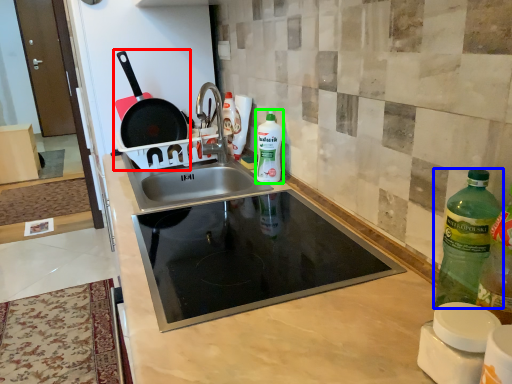
Question: Which object is the farthest from frying pan (highlighted by a red box)? Choose among these: bottle (highlighted by a blue box) or bottle (highlighted by a green box).

Choices:
 (A) bottle
 (B) bottle

Answer: (A)